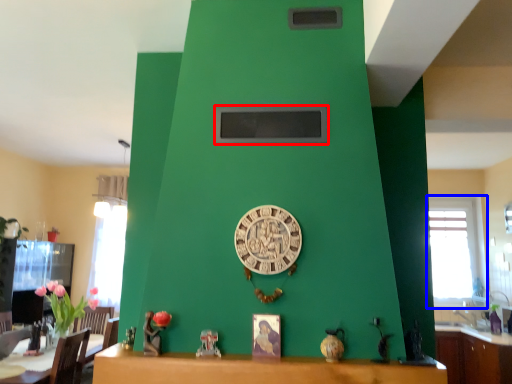
Question: Which object is further to the camera taking this photo, window screen (highlighted by a red box) or window (highlighted by a blue box)?

Choices:
 (A) window screen
 (B) window

Answer: (B)